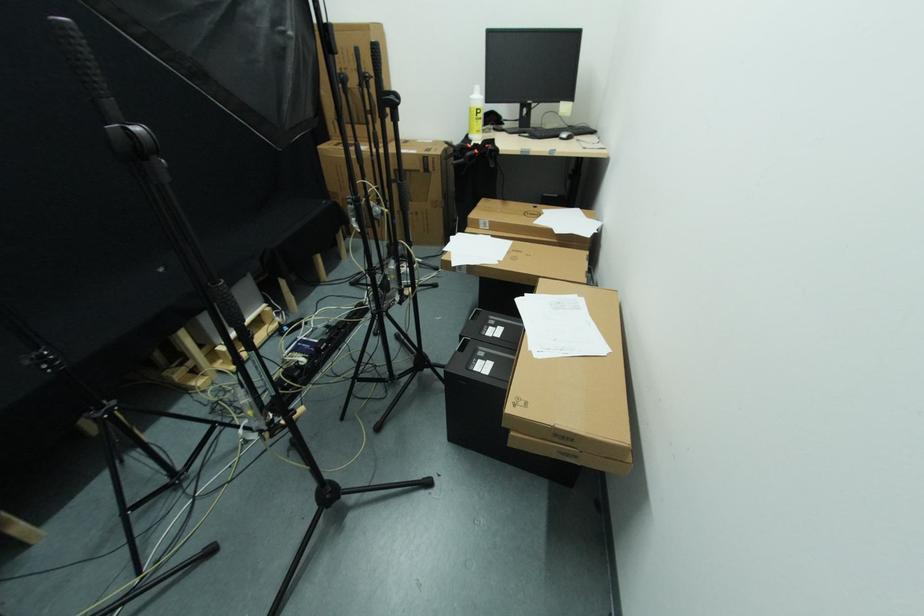
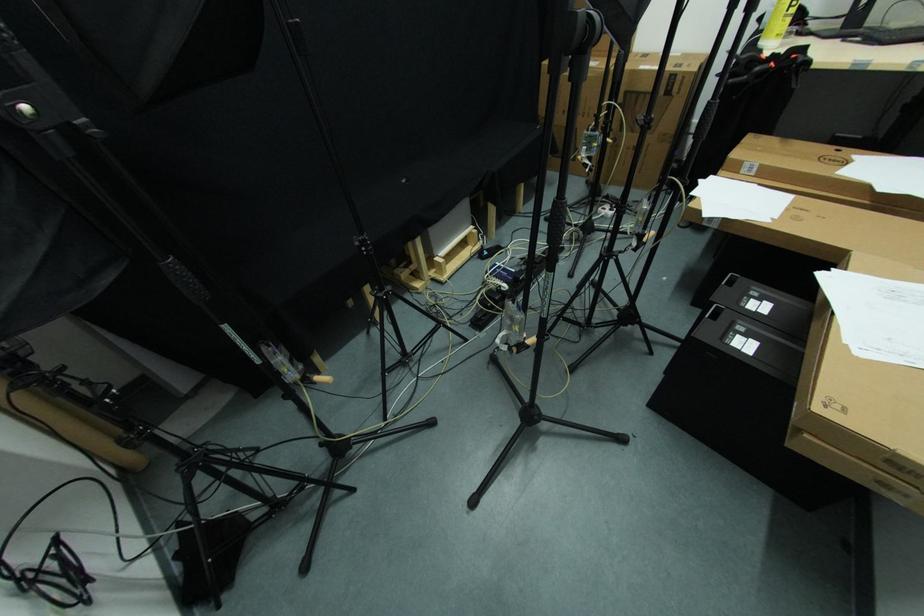
Find the pixel in the second image that matches point (525, 298) in the first image.

(830, 273)